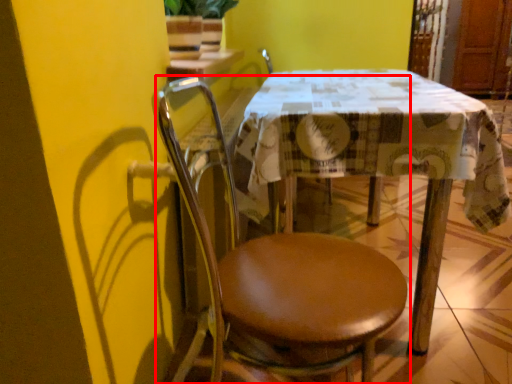
Question: From the image's perspective, what is the correct spatial relationship of chair (annotated by the red box) in relation to table?

Choices:
 (A) below
 (B) above

Answer: (A)